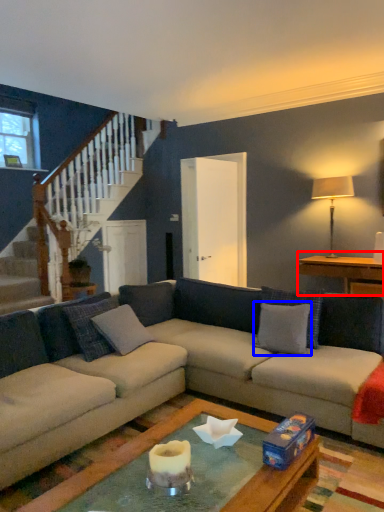
Question: Which point is further to the camera, table (highlighted by a red box) or pillow (highlighted by a blue box)?

Choices:
 (A) table
 (B) pillow

Answer: (A)